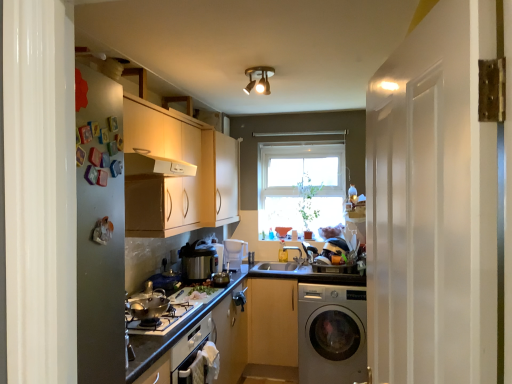
Question: Can you confirm if smooth white countertop at center is bigger than light wood cabinet at center, positioned as the second cabinetry in left-to-right order?

Choices:
 (A) yes
 (B) no

Answer: (B)

Question: Is there a large distance between smooth white countertop at center and light wood cabinet at center, positioned as the second cabinetry in left-to-right order?

Choices:
 (A) no
 (B) yes

Answer: (A)

Question: From the image's perspective, is smooth white countertop at center located above light wood cabinet at center, the first cabinetry in the bottom-to-top sequence?

Choices:
 (A) no
 (B) yes

Answer: (B)

Question: Can you confirm if smooth white countertop at center is wider than light wood cabinet at center, positioned as the second cabinetry in left-to-right order?

Choices:
 (A) no
 (B) yes

Answer: (A)

Question: Is the depth of smooth white countertop at center less than that of light wood cabinet at center, arranged as the 1th cabinetry when viewed from the right?

Choices:
 (A) no
 (B) yes

Answer: (B)

Question: Relative to shiny silver pot at lower left, positioned as the 4th appliance in back-to-front order, is brass/bronze finish spotlight at upper center in front or behind?

Choices:
 (A) behind
 (B) front

Answer: (A)

Question: In terms of width, does brass/bronze finish spotlight at upper center look wider or thinner when compared to shiny silver pot at lower left, positioned as the 4th appliance in back-to-front order?

Choices:
 (A) wide
 (B) thin

Answer: (B)

Question: From a real-world perspective, relative to shiny silver pot at lower left, placed as the first appliance when sorted from front to back, is brass/bronze finish spotlight at upper center vertically above or below?

Choices:
 (A) above
 (B) below

Answer: (A)

Question: Considering the positions of point (263, 82) and point (166, 307), is point (263, 82) closer or farther from the camera than point (166, 307)?

Choices:
 (A) farther
 (B) closer

Answer: (A)

Question: In terms of height, does silver metallic washing machine at lower right look taller or shorter compared to matte white cabinets at center, which is the 2th cabinetry from bottom to top?

Choices:
 (A) short
 (B) tall

Answer: (B)

Question: In terms of width, does silver metallic washing machine at lower right look wider or thinner when compared to matte white cabinets at center, arranged as the first cabinetry when viewed from the top?

Choices:
 (A) thin
 (B) wide

Answer: (B)

Question: Visually, is silver metallic washing machine at lower right positioned to the left or to the right of matte white cabinets at center, the second cabinetry in the right-to-left sequence?

Choices:
 (A) right
 (B) left

Answer: (A)

Question: Does point (330, 357) appear closer or farther from the camera than point (227, 187)?

Choices:
 (A) closer
 (B) farther

Answer: (A)

Question: Is clear glass window at center situated inside light wood cabinet at center, the second cabinetry from the top, or outside?

Choices:
 (A) outside
 (B) inside

Answer: (A)

Question: Considering the positions of clear glass window at center and light wood cabinet at center, arranged as the 1th cabinetry when viewed from the right, in the image, is clear glass window at center bigger or smaller than light wood cabinet at center, arranged as the 1th cabinetry when viewed from the right,?

Choices:
 (A) big
 (B) small

Answer: (B)